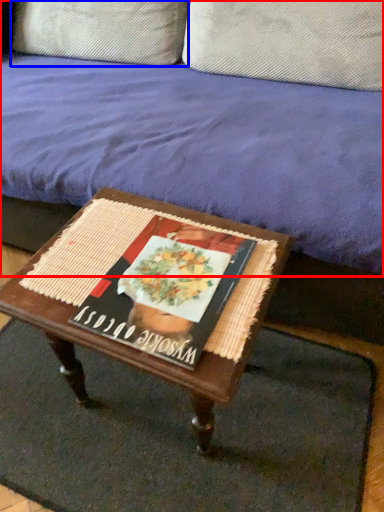
Question: Which object is further to the camera taking this photo, studio couch (highlighted by a red box) or pillow (highlighted by a blue box)?

Choices:
 (A) studio couch
 (B) pillow

Answer: (B)